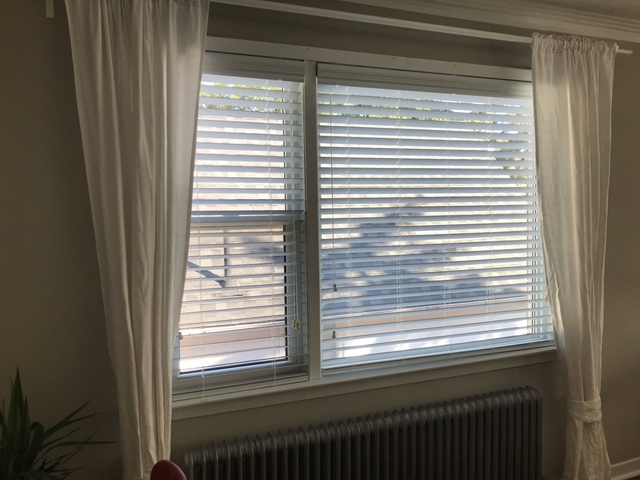
Identify the location of curtains. (157, 124), (582, 133).